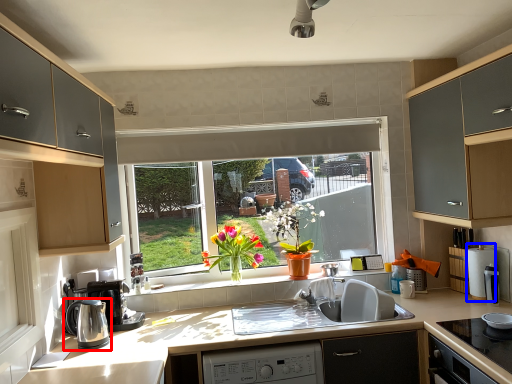
Question: Which of the following is the farthest to the observer, kitchen appliance (highlighted by a red box) or appliance (highlighted by a blue box)?

Choices:
 (A) kitchen appliance
 (B) appliance

Answer: (B)